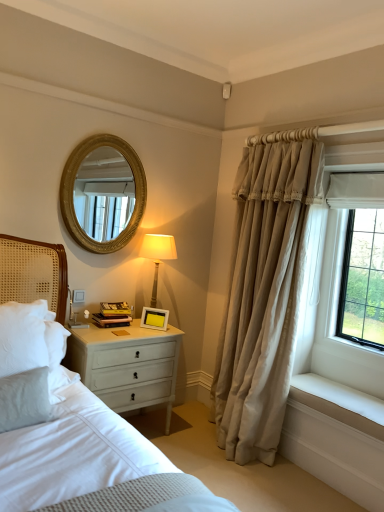
Where is `vacant point to the left of white matte picture frame at upper right`? This screenshot has width=384, height=512. vacant point to the left of white matte picture frame at upper right is located at coordinates (135, 327).